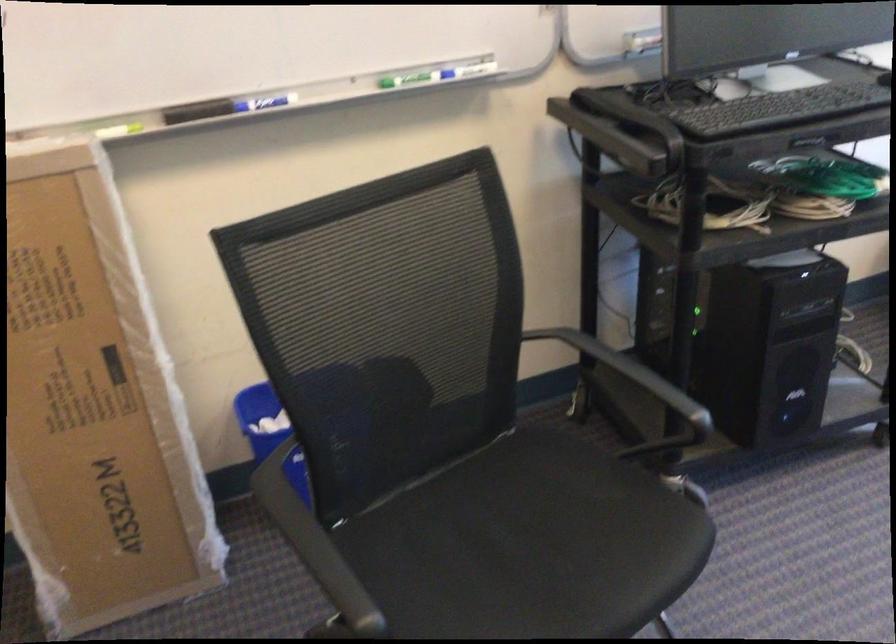
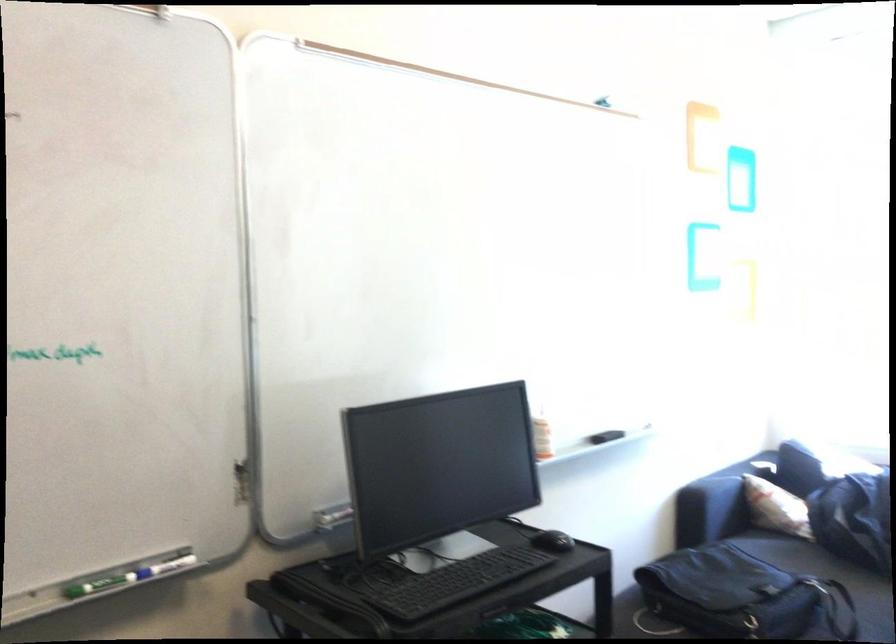
First-person continuous shooting, in which direction is the camera rotating?

The camera rotated toward right-up.